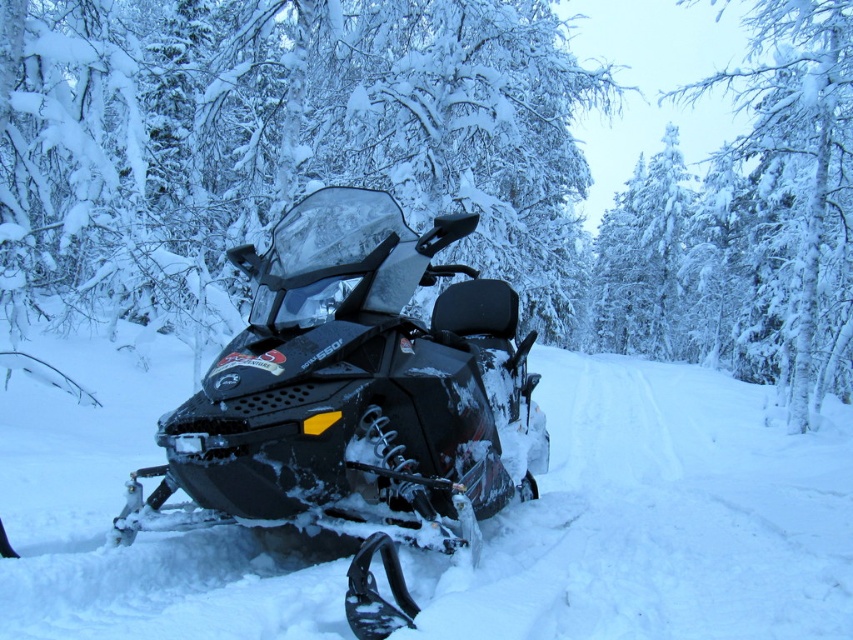
You are a photographer planning to capture a wide shot of the snowy branches at center and the matte black snowmobile at center. Based on the scene description, which object occupies a larger horizontal space in the image?

The snowy branches at center occupy a larger horizontal space in the image because their width surpasses that of the matte black snowmobile at center.

You are a photographer planning to take a photo of the snowy branches at center and the white matte snow at center. Which object will appear closer to the camera in the photo?

The snowy branches at center will appear closer to the camera because the white matte snow at center is behind it.

Based on the photo, you are a photographer aiming to capture the snowy branches at center and the white matte snow at center in your shot. Which object should you adjust your camera focus to first if you want to ensure both are in frame?

The snowy branches at center is positioned on the right side of white matte snow at center, so you should focus on the snowy branches at center first to ensure both are in frame.